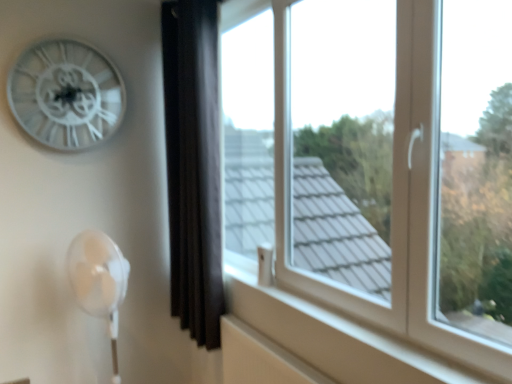
This screenshot has width=512, height=384. In order to click on white metallic clock at upper left in this screenshot , I will do `click(66, 94)`.

At what (x,y) coordinates should I click in order to perform the action: click on black velvet curtain at center. Please return your answer as a coordinate pair (x, y). The image size is (512, 384). Looking at the image, I should click on (193, 165).

From a real-world perspective, is black velvet curtain at center below transparent glass window at center?

Correct, in the physical world, black velvet curtain at center is lower than transparent glass window at center.

From the image's perspective, which is above, black velvet curtain at center or transparent glass window at center?

transparent glass window at center is shown above in the image.

Consider the image. Are black velvet curtain at center and transparent glass window at center far apart?

black velvet curtain at center is actually quite close to transparent glass window at center.

Is transparent glass window at center at the back of black velvet curtain at center?

That's right, black velvet curtain at center is facing away from transparent glass window at center.

From the picture: From a real-world perspective, who is located higher, white metallic clock at upper left or transparent glass window at center?

From a 3D spatial view, white metallic clock at upper left is above.

Is white metallic clock at upper left turned away from transparent glass window at center?

No.

Is white metallic clock at upper left not within transparent glass window at center?

That's correct, white metallic clock at upper left is outside of transparent glass window at center.

Considering the positions of objects white metallic clock at upper left and transparent glass window at center in the image provided, who is more to the left, white metallic clock at upper left or transparent glass window at center?

Positioned to the left is white metallic clock at upper left.

Is point (319, 17) closer to viewer compared to point (188, 150)?

No, it is behind (188, 150).

Does transparent glass window at center have a greater height compared to black velvet curtain at center?

In fact, transparent glass window at center may be shorter than black velvet curtain at center.

Is transparent glass window at center looking in the opposite direction of black velvet curtain at center?

Yes.

From a real-world perspective, is transparent glass window at center located higher than black velvet curtain at center?

Yes.

From their relative heights in the image, would you say transparent glass window at center is taller or shorter than white metallic clock at upper left?

transparent glass window at center is taller than white metallic clock at upper left.

From a real-world perspective, is transparent glass window at center physically located above or below white metallic clock at upper left?

transparent glass window at center is situated lower than white metallic clock at upper left in the real world.

Is transparent glass window at center far away from white metallic clock at upper left?

No, transparent glass window at center is in close proximity to white metallic clock at upper left.

Is transparent glass window at center not inside white metallic clock at upper left?

transparent glass window at center lies outside white metallic clock at upper left's area.

Does white metallic clock at upper left have a lesser width compared to black velvet curtain at center?

Yes, white metallic clock at upper left is thinner than black velvet curtain at center.

Does point (21, 83) come farther from viewer compared to point (203, 37)?

Yes, it is.

Relative to black velvet curtain at center, is white metallic clock at upper left in front or behind?

Visually, white metallic clock at upper left is located behind black velvet curtain at center.

Is black velvet curtain at center with white metallic clock at upper left?

black velvet curtain at center and white metallic clock at upper left are not in contact.

Considering the sizes of objects black velvet curtain at center and white metallic clock at upper left in the image provided, who is smaller, black velvet curtain at center or white metallic clock at upper left?

Smaller between the two is white metallic clock at upper left.

How different are the orientations of black velvet curtain at center and white metallic clock at upper left in degrees?

90.1 degrees separate the facing orientations of black velvet curtain at center and white metallic clock at upper left.

Between black velvet curtain at center and white metallic clock at upper left, which one has more height?

Standing taller between the two is black velvet curtain at center.

In the image, there is a transparent glass window at center. Find the location of `curtain below it (from a real-world perspective)`. curtain below it (from a real-world perspective) is located at coordinates (193, 165).

You are a GUI agent. You are given a task and a screenshot of the screen. Output one action in this format:
    pyautogui.click(x=<x>, y=<y>)
    Task: Click on the wall clock above the transparent glass window at center (from a real-world perspective)
    Image resolution: width=512 pixels, height=384 pixels.
    Given the screenshot: What is the action you would take?
    pyautogui.click(x=66, y=94)

Looking at the image, which one is located closer to white metallic clock at upper left, black velvet curtain at center or transparent glass window at center?

Among the two, black velvet curtain at center is located nearer to white metallic clock at upper left.

Considering their positions, is black velvet curtain at center positioned closer to transparent glass window at center than white metallic clock at upper left?

black velvet curtain at center.

Based on their spatial positions, is transparent glass window at center or white metallic clock at upper left further from black velvet curtain at center?

Based on the image, white metallic clock at upper left appears to be further to black velvet curtain at center.

Which object lies further to the anchor point transparent glass window at center, white metallic clock at upper left or black velvet curtain at center?

white metallic clock at upper left is positioned further to the anchor transparent glass window at center.

Considering their positions, is transparent glass window at center positioned closer to white metallic clock at upper left than black velvet curtain at center?

Among the two, black velvet curtain at center is located nearer to white metallic clock at upper left.

From the picture: When comparing their distances from black velvet curtain at center, does white metallic clock at upper left or transparent glass window at center seem closer?

transparent glass window at center lies closer to black velvet curtain at center than the other object.

You are a GUI agent. You are given a task and a screenshot of the screen. Output one action in this format:
    pyautogui.click(x=<x>, y=<y>)
    Task: Click on the curtain positioned between transparent glass window at center and white metallic clock at upper left from near to far
    
    Given the screenshot: What is the action you would take?
    pyautogui.click(x=193, y=165)